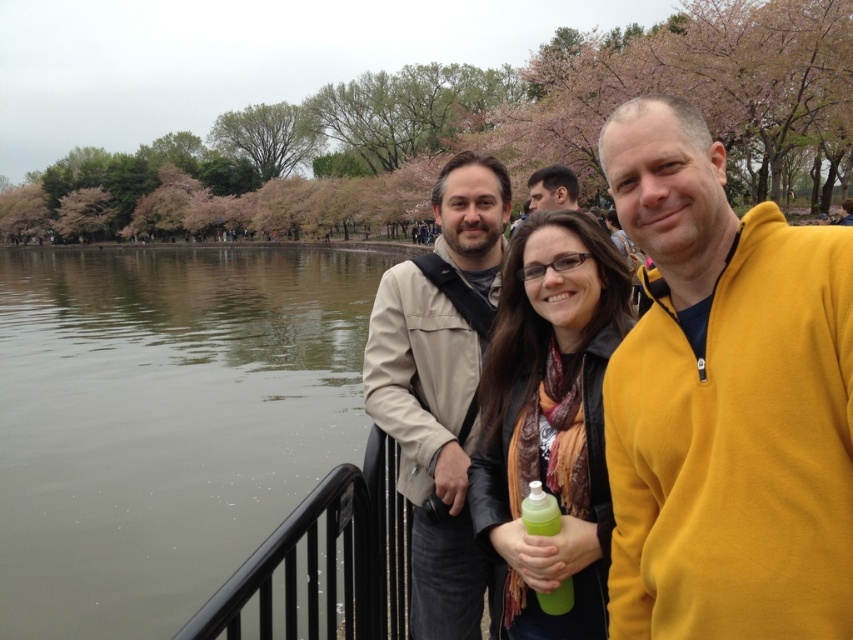
You are a photographer trying to capture a clear shot of the two jackets in the image. Given that the leather jacket at center and the beige fabric jacket at center are both visible, which jacket would require a wider angle lens to fully capture in the photo?

The beige fabric jacket at center requires a wider angle lens because it occupies more space than the leather jacket at center, necessitating a wider field of view to capture its entirety.

Looking at this image, you are standing at the point with coordinates point (549, 173) and want to walk towards the point with coordinates point (537, 513). Which direction should you face to walk directly towards it?

You should face towards the right direction to walk directly towards point (537, 513) from point (549, 173) since it is located to the right side.

You are a photographer standing 2 meters away from the group. You want to take a photo that includes both the green translucent bottle at center and the matte black jacket at upper center without moving the subjects. Can you capture both in the same frame?

The distance between the green translucent bottle at center and the matte black jacket at upper center is 1.94 meters, which is less than the 2 meters you are away from the group. Therefore, you can capture both in the same frame without moving the subjects.